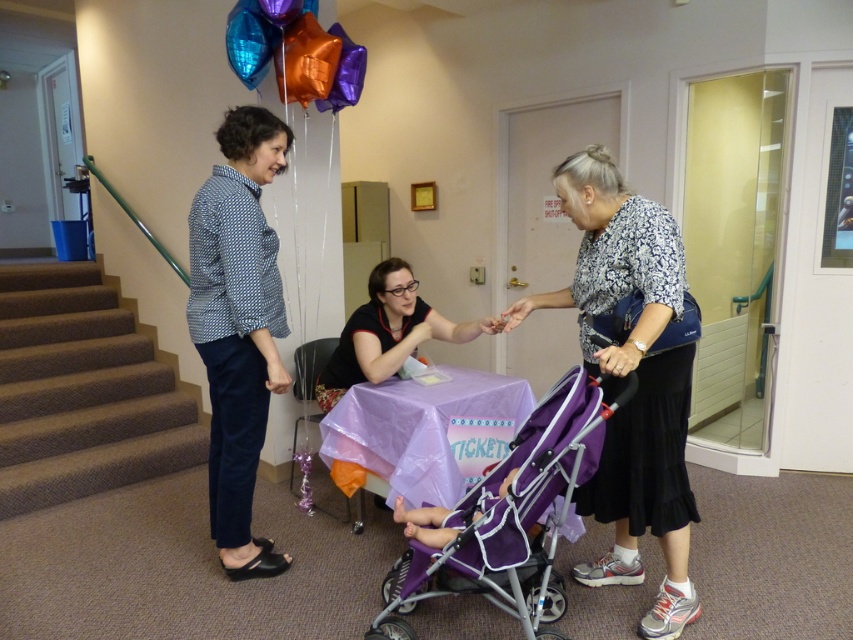
Is point (442, 552) positioned before point (360, 67)?

Yes.

Does purple fabric stroller at center have a lesser width compared to purple glossy balloon at upper center?

No, purple fabric stroller at center is not thinner than purple glossy balloon at upper center.

I want to click on purple fabric stroller at center, so click(508, 516).

From the picture: How far apart are purple fabric table at center and matte black shirt at center?

They are 23.58 inches apart.

Can you confirm if purple fabric table at center is shorter than matte black shirt at center?

Incorrect, purple fabric table at center's height does not fall short of matte black shirt at center's.

The width and height of the screenshot is (853, 640). What do you see at coordinates (628, 372) in the screenshot? I see `purple fabric table at center` at bounding box center [628, 372].

Where is `purple fabric table at center`? Image resolution: width=853 pixels, height=640 pixels. purple fabric table at center is located at coordinates click(628, 372).

Does brown carpeted stairs at left have a greater width compared to matte black shirt at center?

Indeed, brown carpeted stairs at left has a greater width compared to matte black shirt at center.

Does brown carpeted stairs at left have a lesser height compared to matte black shirt at center?

No, brown carpeted stairs at left is not shorter than matte black shirt at center.

Where is `brown carpeted stairs at left`? This screenshot has height=640, width=853. brown carpeted stairs at left is located at coordinates (80, 392).